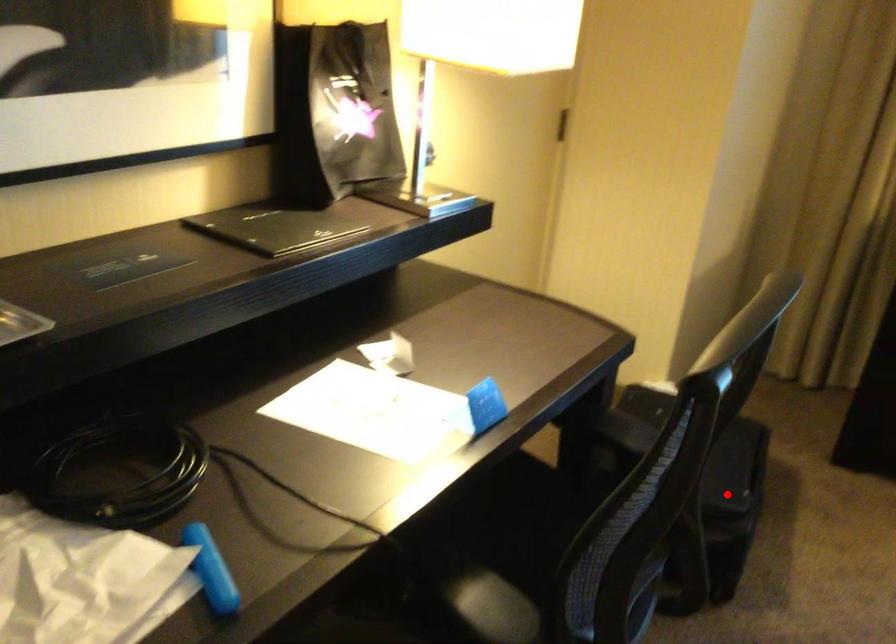
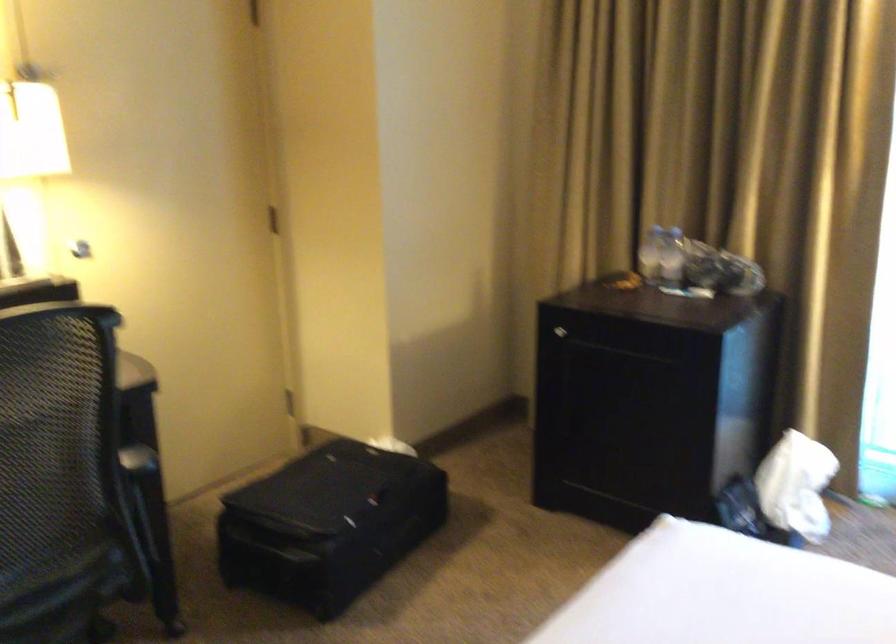
Question: I am providing you with two images of the same scene from different viewpoints. A red point is shown in image1. For the corresponding object point in image2, is it positioned nearer or farther from the camera?

Choices:
 (A) Nearer
 (B) Farther

Answer: (B)